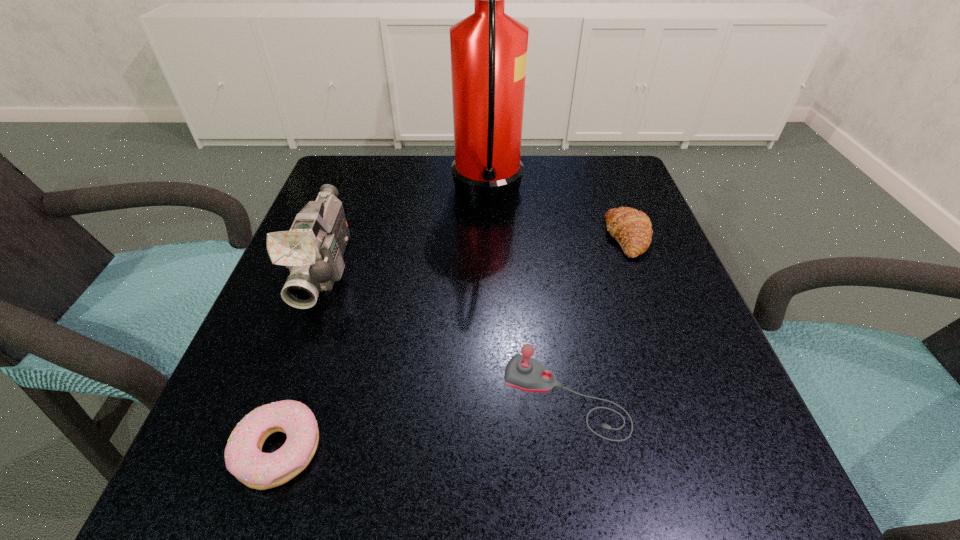
Find the location of a particular element. The height and width of the screenshot is (540, 960). fire extinguisher is located at coordinates (488, 49).

Locate an element on the screen. This screenshot has width=960, height=540. camcorder is located at coordinates (313, 249).

I want to click on the third shortest object, so click(x=522, y=372).

The height and width of the screenshot is (540, 960). What are the coordinates of `crescent roll` in the screenshot? It's located at (631, 228).

Locate an element on the screen. The height and width of the screenshot is (540, 960). the second shortest object is located at coordinates (631, 228).

In order to click on doughnut in this screenshot , I will do `click(244, 459)`.

You are a GUI agent. You are given a task and a screenshot of the screen. Output one action in this format:
    pyautogui.click(x=<x>, y=<y>)
    Task: Click on the free space located 0.200m at the spray nozzle of the fire extinguisher
    The height and width of the screenshot is (540, 960).
    Given the screenshot: What is the action you would take?
    coord(363,198)

The image size is (960, 540). I want to click on vacant space located 0.170m at the spray nozzle of the fire extinguisher, so click(376, 198).

I want to click on vacant area situated at the spray nozzle of the fire extinguisher, so click(367, 198).

Where is `vacant space situated on the front-facing side of the camcorder`? Image resolution: width=960 pixels, height=540 pixels. vacant space situated on the front-facing side of the camcorder is located at coordinates (263, 442).